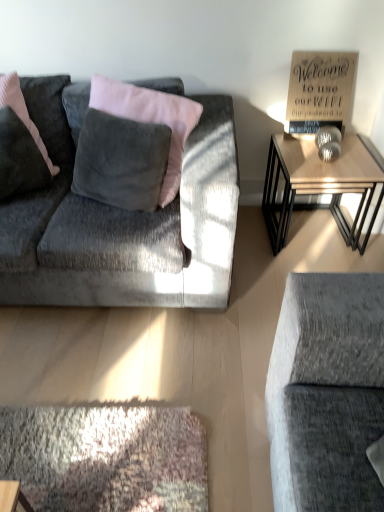
Find the location of a particular element. The height and width of the screenshot is (512, 384). free location in front of wooden table at right is located at coordinates (302, 270).